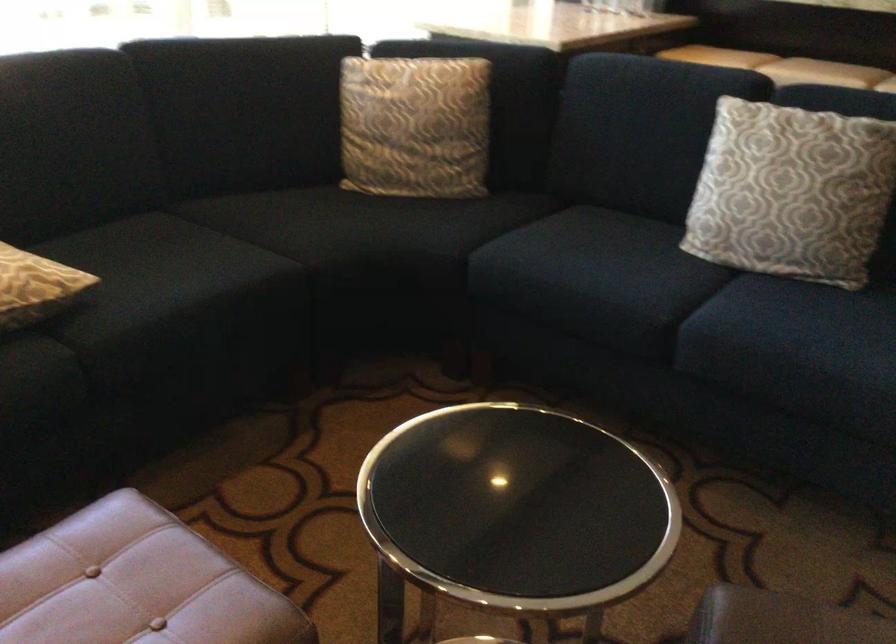
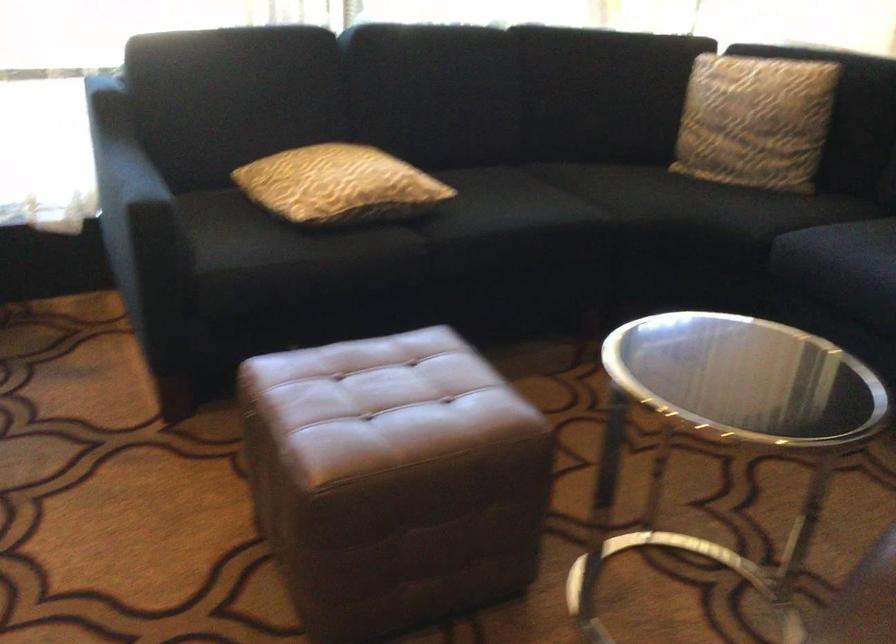
Where in the second image is the point corresponding to point 74,325 from the first image?

(426, 227)